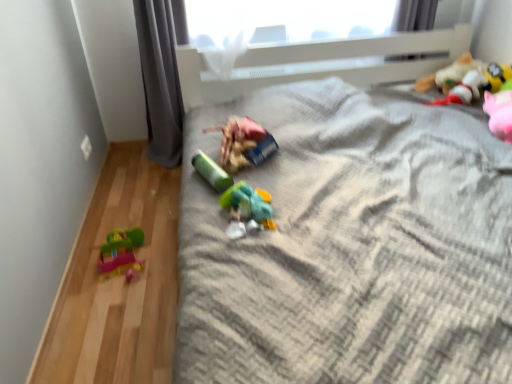
Question: Is matte plastic toy at center, the fourth toy when ordered from right to left, surrounding green matte cylinder at center, the 2th toy from the left?

Choices:
 (A) yes
 (B) no

Answer: (B)

Question: Are matte plastic toy at center, the third toy from the left, and green matte cylinder at center, acting as the fifth toy starting from the right, far apart?

Choices:
 (A) no
 (B) yes

Answer: (A)

Question: Is matte plastic toy at center, the fourth toy when ordered from right to left, to the right of green matte cylinder at center, acting as the fifth toy starting from the right, from the viewer's perspective?

Choices:
 (A) no
 (B) yes

Answer: (B)

Question: Can you confirm if matte plastic toy at center, the fourth toy when ordered from right to left, is smaller than green matte cylinder at center, acting as the fifth toy starting from the right?

Choices:
 (A) yes
 (B) no

Answer: (B)

Question: Is matte plastic toy at center, the fourth toy when ordered from right to left, directly adjacent to green matte cylinder at center, acting as the fifth toy starting from the right?

Choices:
 (A) yes
 (B) no

Answer: (B)

Question: From the image's perspective, is matte plastic toy at center, the third toy from the left, below green matte cylinder at center, acting as the fifth toy starting from the right?

Choices:
 (A) yes
 (B) no

Answer: (B)

Question: Would you say gray fabric curtain at left is part of matte plastic toy at center, the fourth toy when ordered from right to left,'s contents?

Choices:
 (A) no
 (B) yes

Answer: (A)

Question: Does matte plastic toy at center, the third toy from the left, have a larger size compared to gray fabric curtain at left?

Choices:
 (A) no
 (B) yes

Answer: (A)

Question: Could you tell me if matte plastic toy at center, the third toy from the left, is turned towards gray fabric curtain at left?

Choices:
 (A) no
 (B) yes

Answer: (A)

Question: Is matte plastic toy at center, the fourth toy when ordered from right to left, smaller than gray fabric curtain at left?

Choices:
 (A) no
 (B) yes

Answer: (B)

Question: From the image's perspective, is matte plastic toy at center, the fourth toy when ordered from right to left, beneath gray fabric curtain at left?

Choices:
 (A) yes
 (B) no

Answer: (A)

Question: Can you confirm if matte plastic toy at center, the fourth toy when ordered from right to left, is shorter than gray fabric curtain at left?

Choices:
 (A) no
 (B) yes

Answer: (B)

Question: Can you confirm if translucent plastic toy at center, which is the fourth toy from left to right, is shorter than plastic toy car at left, the first toy from the left?

Choices:
 (A) no
 (B) yes

Answer: (B)